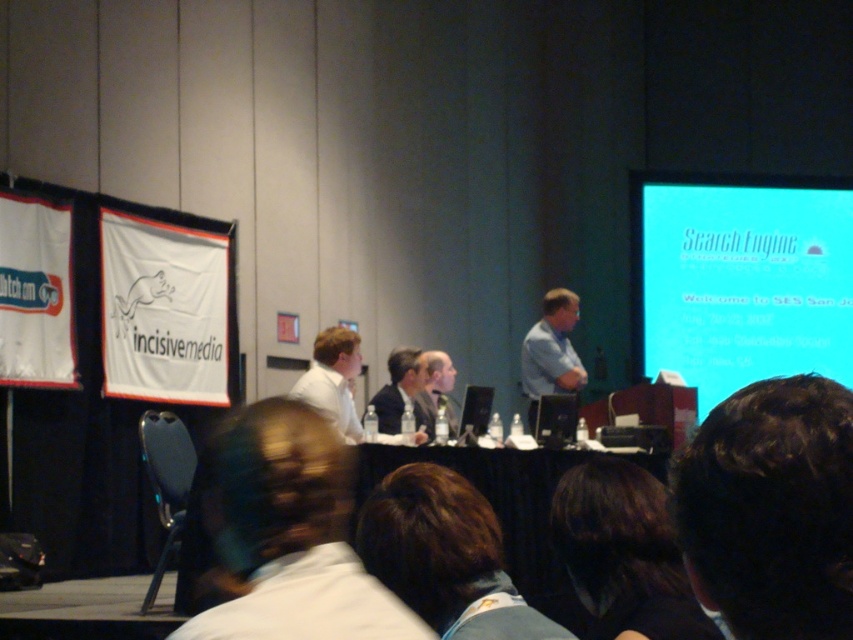
You are standing at the camera position and want to walk to point (x=706, y=500). Can you reach it without moving past the stage? The stage is where the panelists are seated.

Yes, because the distance between you and point (x=706, y=500) is 3.65 feet, which is within the stage area where the panelists are seated.

You are an attendee sitting in the audience and want to see both the dark brown hair at upper right and the white shirt at center clearly. Which one would you need to look past first?

The dark brown hair at upper right is in front of the white shirt at center, so you would need to look past the dark brown hair at upper right first to see the white shirt at center.